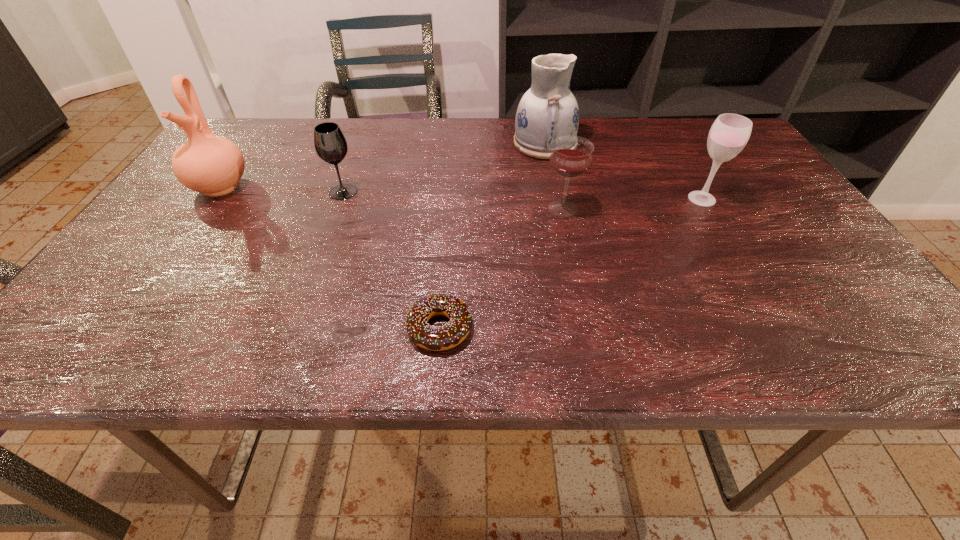
Locate an element on the screen. The image size is (960, 540). free spot between the fifth object from right to left and the second wineglass from left to right is located at coordinates (453, 200).

Find the location of `free space between the shortest object and the rightmost object`. free space between the shortest object and the rightmost object is located at coordinates (570, 264).

You are a GUI agent. You are given a task and a screenshot of the screen. Output one action in this format:
    pyautogui.click(x=<x>, y=<y>)
    Task: Click on the vacant area that lies between the farthest object and the left pottery
    This screenshot has height=540, width=960.
    Given the screenshot: What is the action you would take?
    pyautogui.click(x=383, y=165)

I want to click on free point between the left pottery and the second wineglass from left to right, so click(x=392, y=197).

You are a GUI agent. You are given a task and a screenshot of the screen. Output one action in this format:
    pyautogui.click(x=<x>, y=<y>)
    Task: Click on the vacant space in between the leftmost wineglass and the second wineglass from right to left
    The height and width of the screenshot is (540, 960).
    Given the screenshot: What is the action you would take?
    pyautogui.click(x=453, y=200)

Find the location of a particular element. This screenshot has height=540, width=960. unoccupied area between the rightmost object and the doughnut is located at coordinates [x=570, y=264].

Identify which object is located as the fifth nearest to the second wineglass from left to right. Please provide its 2D coordinates. Your answer should be formatted as a tuple, i.e. [(x, y)], where the tuple contains the x and y coordinates of a point satisfying the conditions above.

[(212, 165)]

The width and height of the screenshot is (960, 540). I want to click on the second closest object to the doughnut, so click(330, 144).

The width and height of the screenshot is (960, 540). I want to click on the second closest wineglass to the rightmost object, so click(x=330, y=144).

This screenshot has width=960, height=540. I want to click on wineglass that is the nearest to the second wineglass from right to left, so click(x=729, y=134).